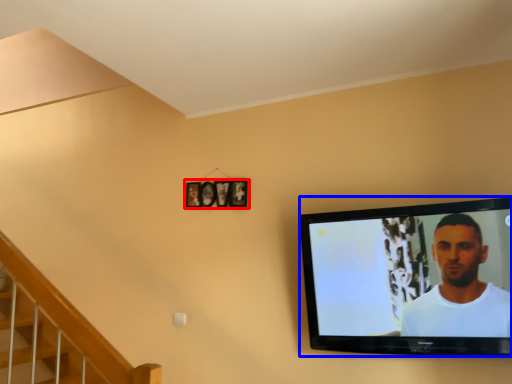
Question: Which point is closer to the camera, picture frame (highlighted by a red box) or television (highlighted by a blue box)?

Choices:
 (A) picture frame
 (B) television

Answer: (B)